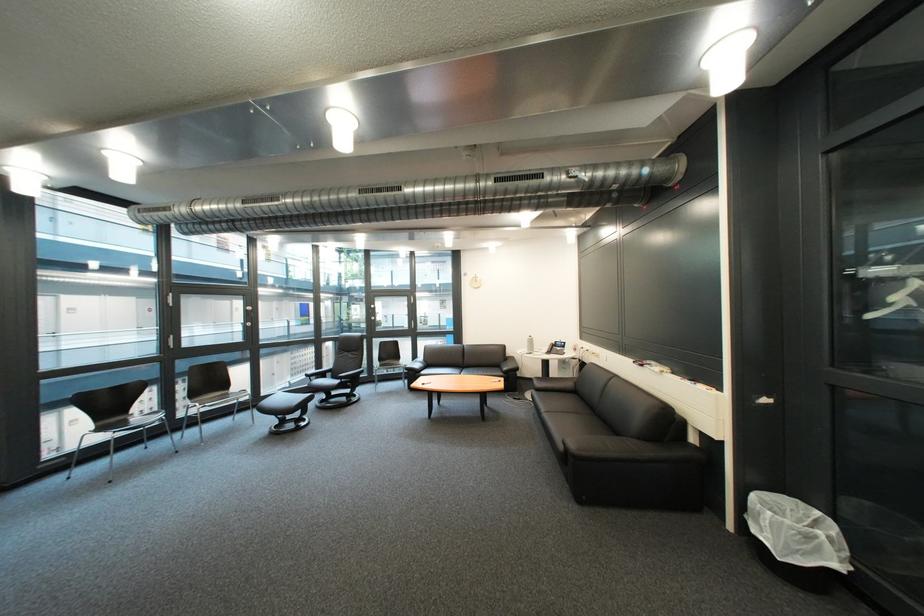
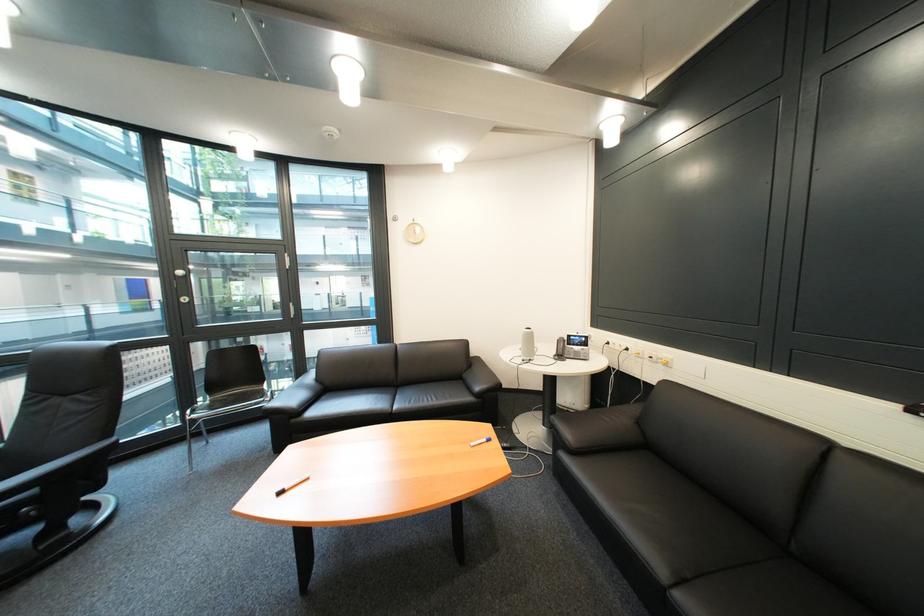
Question: The images are taken continuously from a first-person perspective. In which direction are you moving?

Choices:
 (A) Left
 (B) Right
 (C) Forward
 (D) Backward

Answer: (C)